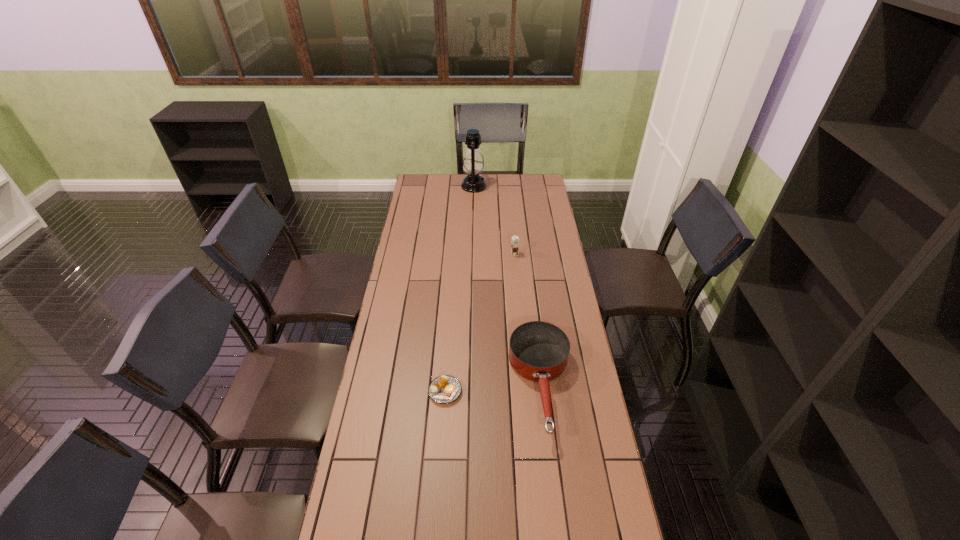
The height and width of the screenshot is (540, 960). I want to click on object present at the right edge, so click(x=538, y=351).

In the image, there is a desktop. At what (x,y) coordinates should I click in order to perform the action: click on free space at the far edge. Please return your answer as a coordinate pair (x, y). The image size is (960, 540). Looking at the image, I should click on (448, 192).

Locate an element on the screen. This screenshot has width=960, height=540. vacant space at the left edge of the desktop is located at coordinates (400, 256).

Find the location of a particular element. The width and height of the screenshot is (960, 540). vacant space at the right edge of the desktop is located at coordinates (568, 404).

The width and height of the screenshot is (960, 540). In order to click on vacant space that is in between the oil lamp and the pan in this screenshot , I will do `click(507, 286)`.

Find the location of a particular element. The height and width of the screenshot is (540, 960). vacant space that's between the farthest object and the pan is located at coordinates (507, 286).

The image size is (960, 540). I want to click on vacant space that's between the pastry and the chocolate milk, so click(480, 323).

The image size is (960, 540). Find the location of `vacant region between the pan and the chocolate milk`. vacant region between the pan and the chocolate milk is located at coordinates (528, 320).

Where is `the third closest object relative to the pan`? The width and height of the screenshot is (960, 540). the third closest object relative to the pan is located at coordinates (473, 164).

You are a GUI agent. You are given a task and a screenshot of the screen. Output one action in this format:
    pyautogui.click(x=<x>, y=<y>)
    Task: Click on the object that is the closest to the farthest object
    The image size is (960, 540).
    Given the screenshot: What is the action you would take?
    pyautogui.click(x=515, y=240)